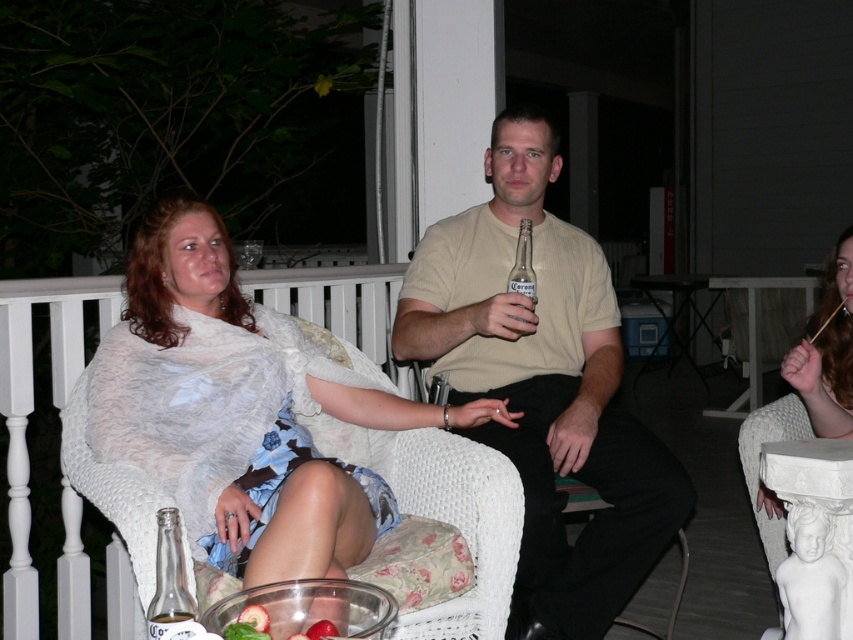
Between point (169, 620) and point (178, 637), which one is positioned in front?

Positioned in front is point (178, 637).

Does clear glass bottle at lower left appear under translucent glass bottle at lower left?

Actually, clear glass bottle at lower left is above translucent glass bottle at lower left.

This screenshot has height=640, width=853. What do you see at coordinates (169, 577) in the screenshot?
I see `clear glass bottle at lower left` at bounding box center [169, 577].

Where is `clear glass bottle at lower left`? This screenshot has width=853, height=640. clear glass bottle at lower left is located at coordinates (169, 577).

Does beige cotton shirt at center appear over clear glass beer bottle at center?

Incorrect, beige cotton shirt at center is not positioned above clear glass beer bottle at center.

Which is above, beige cotton shirt at center or clear glass beer bottle at center?

Positioned higher is clear glass beer bottle at center.

Which is behind, point (424, 272) or point (532, 269)?

Point (424, 272)

At what (x,y) coordinates should I click in order to perform the action: click on beige cotton shirt at center. Please return your answer as a coordinate pair (x, y). Image resolution: width=853 pixels, height=640 pixels. Looking at the image, I should click on (544, 385).

Does white sheer fabric at left lie behind clear glass beer bottle at center?

No, white sheer fabric at left is in front of clear glass beer bottle at center.

Between white sheer fabric at left and clear glass beer bottle at center, which one has less height?

With less height is clear glass beer bottle at center.

Is point (289, 556) positioned after point (521, 237)?

No, it is in front of (521, 237).

Image resolution: width=853 pixels, height=640 pixels. Identify the location of white sheer fabric at left. (247, 412).